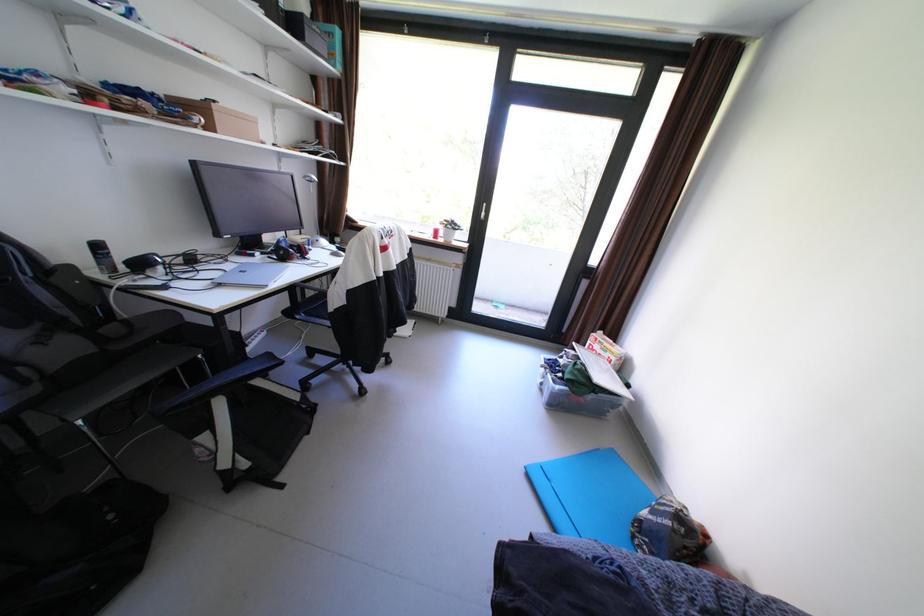
What do you see at coordinates (482, 211) in the screenshot? This screenshot has height=616, width=924. I see `the silver door handle` at bounding box center [482, 211].